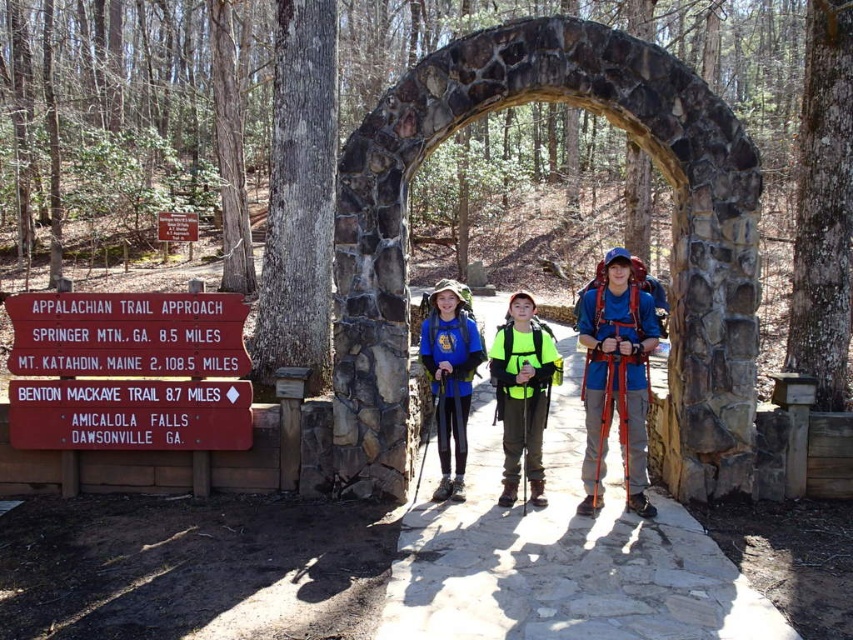
Question: Considering the real-world distances, which object is farthest from the red wooden sign at left?

Choices:
 (A) stone archway at center
 (B) neon yellow vest at center
 (C) blue fleece jacket at center

Answer: (A)

Question: Considering the real-world distances, which object is closest to the blue fleece jacket at center?

Choices:
 (A) neon yellow life jacket at center
 (B) blue fabric backpack at center

Answer: (A)

Question: Which object is farther from the camera taking this photo?

Choices:
 (A) red wooden sign at left
 (B) blue fleece jacket at center

Answer: (B)

Question: Is red wooden sign at left below blue fleece jacket at center?

Choices:
 (A) yes
 (B) no

Answer: (B)

Question: Is stone archway at center bigger than neon yellow vest at center?

Choices:
 (A) yes
 (B) no

Answer: (A)

Question: Is red wooden sign at left below neon yellow life jacket at center?

Choices:
 (A) no
 (B) yes

Answer: (B)